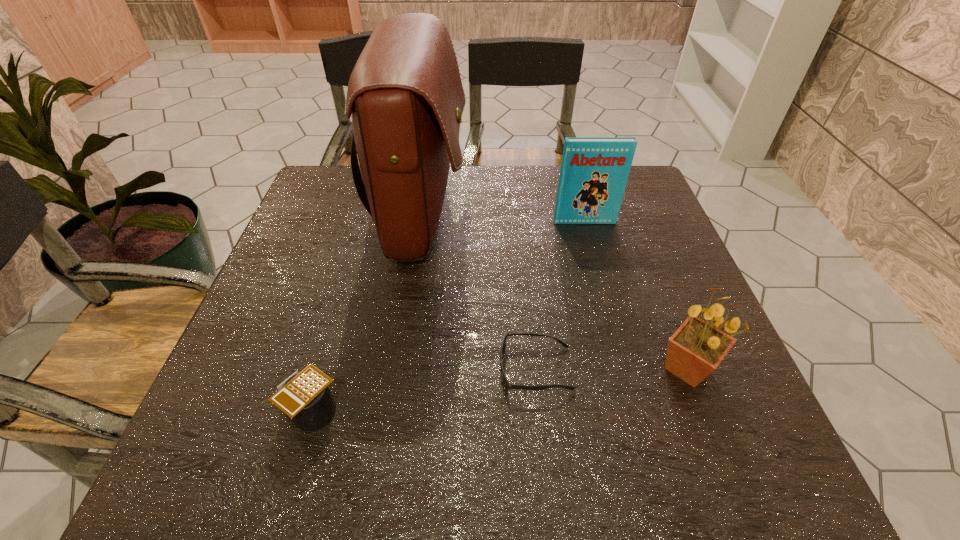
Where is `vacant space in between the tallest object and the book`? The width and height of the screenshot is (960, 540). vacant space in between the tallest object and the book is located at coordinates (503, 219).

Image resolution: width=960 pixels, height=540 pixels. Find the location of `vacant space that is in between the tallest object and the third object from left to right`. vacant space that is in between the tallest object and the third object from left to right is located at coordinates (479, 293).

Identify the location of free spot between the sunflower and the book. (636, 295).

Find the location of a particular element. This screenshot has height=540, width=960. empty space that is in between the fourth tallest object and the book is located at coordinates (448, 317).

This screenshot has height=540, width=960. Find the location of `vacant area between the satchel and the sunflower`. vacant area between the satchel and the sunflower is located at coordinates [x=555, y=293].

This screenshot has height=540, width=960. I want to click on the third closest object relative to the book, so click(507, 385).

Point out which object is positioned as the third nearest to the book. Please provide its 2D coordinates. Your answer should be formatted as a tuple, i.e. [(x, y)], where the tuple contains the x and y coordinates of a point satisfying the conditions above.

[(507, 385)]

The image size is (960, 540). I want to click on free region that satisfies the following two spatial constraints: 1. on the front-facing side of the sunglasses; 2. on the front side of the calculator, so click(x=540, y=412).

Find the location of `vacant region that satisfies the following two spatial constraints: 1. at the front of the sunflower with flowers visible; 2. on the front-facing side of the third object from left to right`. vacant region that satisfies the following two spatial constraints: 1. at the front of the sunflower with flowers visible; 2. on the front-facing side of the third object from left to right is located at coordinates (687, 369).

You are a GUI agent. You are given a task and a screenshot of the screen. Output one action in this format:
    pyautogui.click(x=<x>, y=<y>)
    Task: Click on the free space that satisfies the following two spatial constraints: 1. on the front cover of the book; 2. on the front-facing side of the sunglasses
    The height and width of the screenshot is (540, 960).
    Given the screenshot: What is the action you would take?
    pyautogui.click(x=624, y=369)